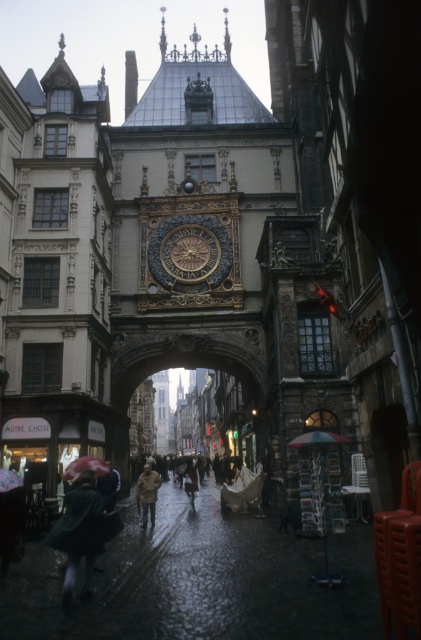
Between point (221, 237) and point (175, 464), which one is positioned in front?

Point (221, 237) is more forward.

How distant is goldmetallicclock at center from transparent plastic umbrella at center?

They are 52.60 meters apart.

Locate an element on the screen. goldmetallicclock at center is located at coordinates [x=189, y=252].

Which is below, goldmetallicclock at center or raincoat matte at center?

raincoat matte at center is below.

Is point (197, 259) more distant than point (191, 480)?

No.

Describe the element at coordinates (189, 252) in the screenshot. The height and width of the screenshot is (640, 421). I see `goldmetallicclock at center` at that location.

Locate an element on the screen. This screenshot has height=640, width=421. goldmetallicclock at center is located at coordinates (189, 252).

Which of these two, rainy asphalt alley at center or multicolored fabric umbrella at lower center, stands taller?

Standing taller between the two is multicolored fabric umbrella at lower center.

What are the coordinates of `rainy asphalt alley at center` in the screenshot? It's located at (199, 580).

Which is behind, point (344, 557) or point (298, 438)?

The point (298, 438) is more distant.

Identify the location of rainy asphalt alley at center. (199, 580).